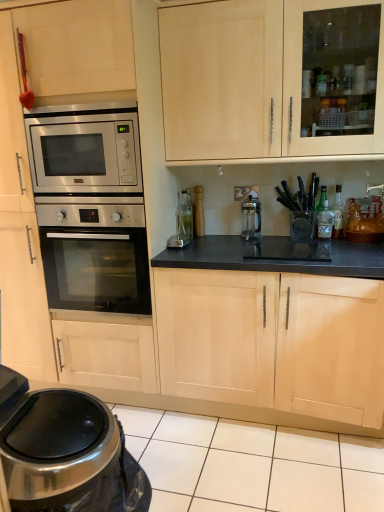
In order to click on free space in front of clear glass bottle at center-right, the third bottle when ordered from right to left in this screenshot , I will do `click(345, 242)`.